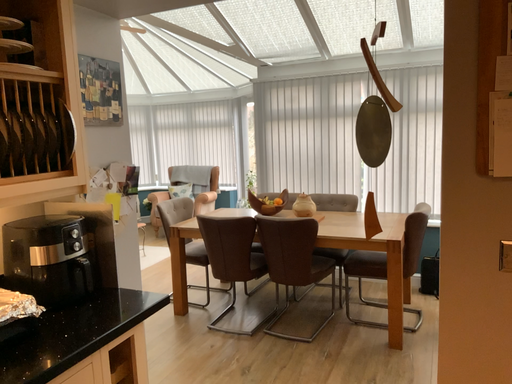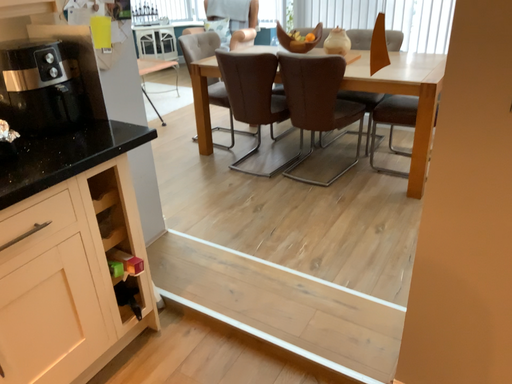
Question: Which way did the camera rotate in the video?

Choices:
 (A) rotated left
 (B) rotated right

Answer: (A)